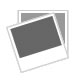
Where is `blurry edge of photo frame`? This screenshot has height=80, width=80. blurry edge of photo frame is located at coordinates 7,28.